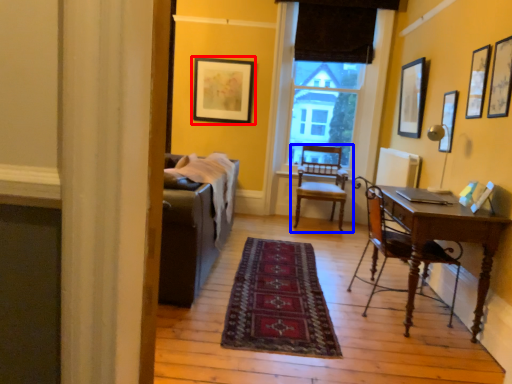
Question: Which of the following is the closest to the observer, picture frame (highlighted by a red box) or chair (highlighted by a blue box)?

Choices:
 (A) picture frame
 (B) chair

Answer: (B)